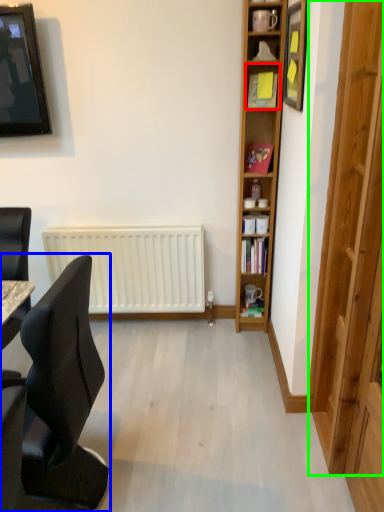
Question: Which object is positioned farthest from shelf (highlighted by a red box)? Select from chair (highlighted by a blue box) and glass door (highlighted by a green box).

Choices:
 (A) chair
 (B) glass door

Answer: (A)